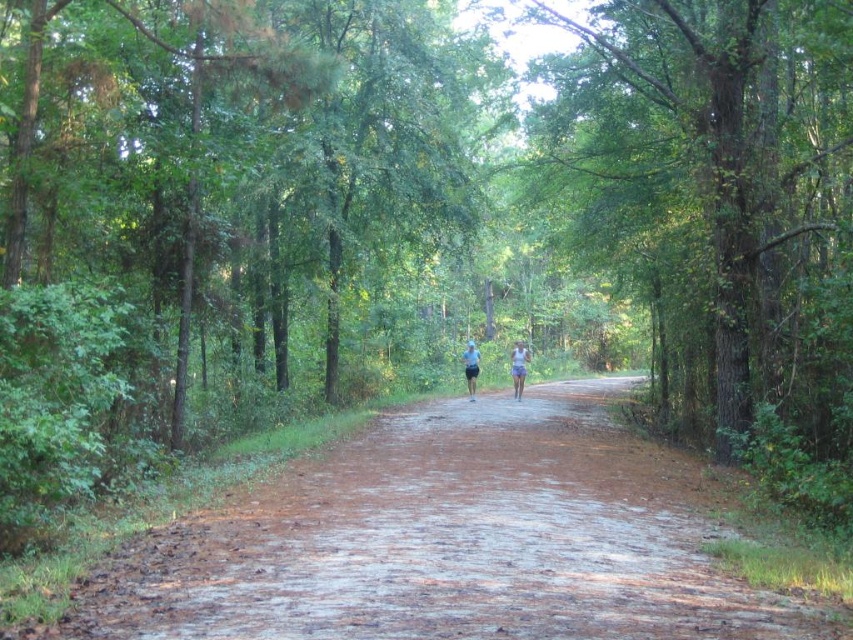
You are planning to jog along the path in the forest. You see the brown dirt road at center and the green leafy tree at center. Which one is wider?

The brown dirt road at center might be wider than the green leafy tree at center according to the description.

You are a photographer planning to capture the joggers in the forest. You notice the white fabric shorts at center and the white fabric shirt at center. Which clothing item will have a shorter shadow due to its position relative to the light source?

The white fabric shorts at center will have a shorter shadow than the white fabric shirt at center because it is shorter in height, making its shadow proportionally smaller.

You are standing at the point marked by the coordinates (451,540) in the forest scene. What is the immediate terrain beneath your feet?

The point marked by the coordinates (451,540) is on the brown dirt road at center, so the immediate terrain beneath your feet is the brown dirt road.